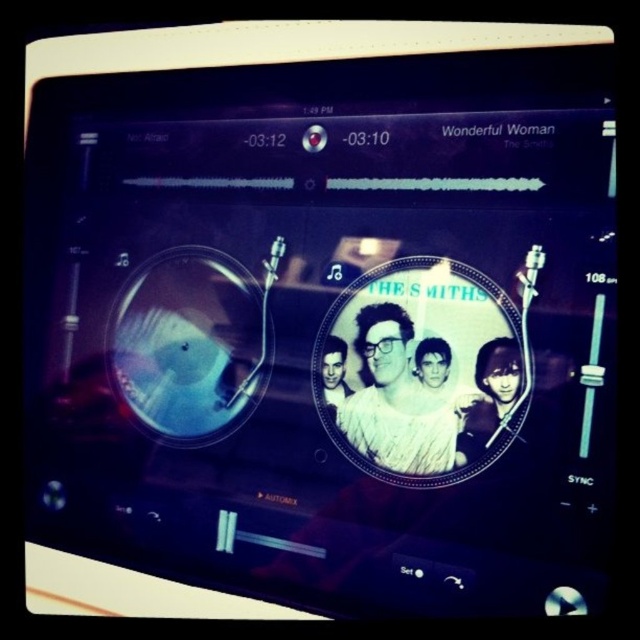
Question: Which object is farther from the camera taking this photo?

Choices:
 (A) smooth skin face at center
 (B) black and white photo of person at center
 (C) black glossy vinyl record at center
 (D) white textured shirt at center

Answer: (B)

Question: Is the position of white textured shirt at center less distant than that of black and white photo of person at center?

Choices:
 (A) no
 (B) yes

Answer: (B)

Question: Can you confirm if white textured shirt at center is positioned above black glossy vinyl record at center?

Choices:
 (A) no
 (B) yes

Answer: (B)

Question: Which of the following is the farthest from the observer?

Choices:
 (A) white textured shirt at center
 (B) black and white photo of person at center
 (C) black glossy vinyl record at center

Answer: (B)

Question: Is white textured shirt at center wider than black and white photo of person at center?

Choices:
 (A) yes
 (B) no

Answer: (A)

Question: Among these objects, which one is farthest from the camera?

Choices:
 (A) black and white photo of person at center
 (B) smooth skin face at center
 (C) black glossy vinyl record at center

Answer: (A)